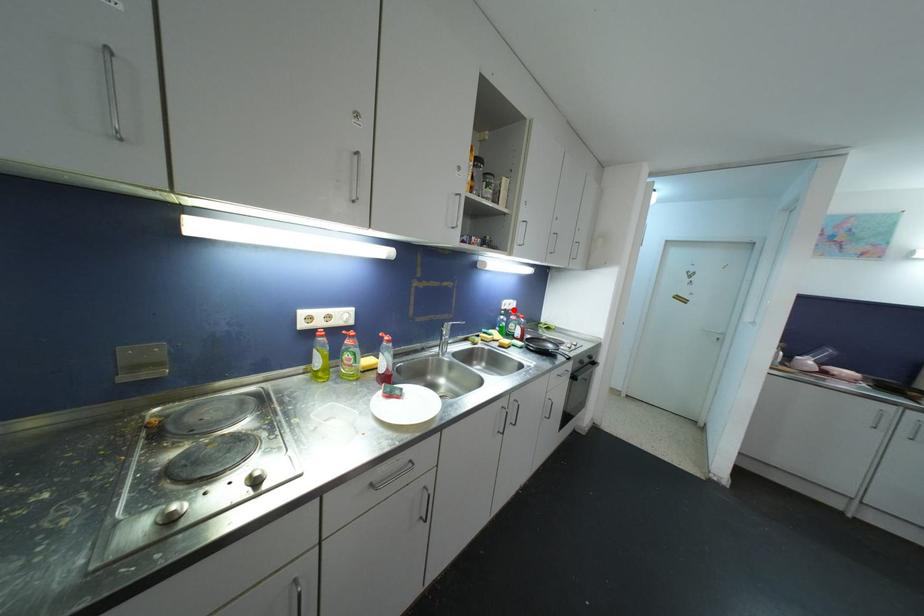
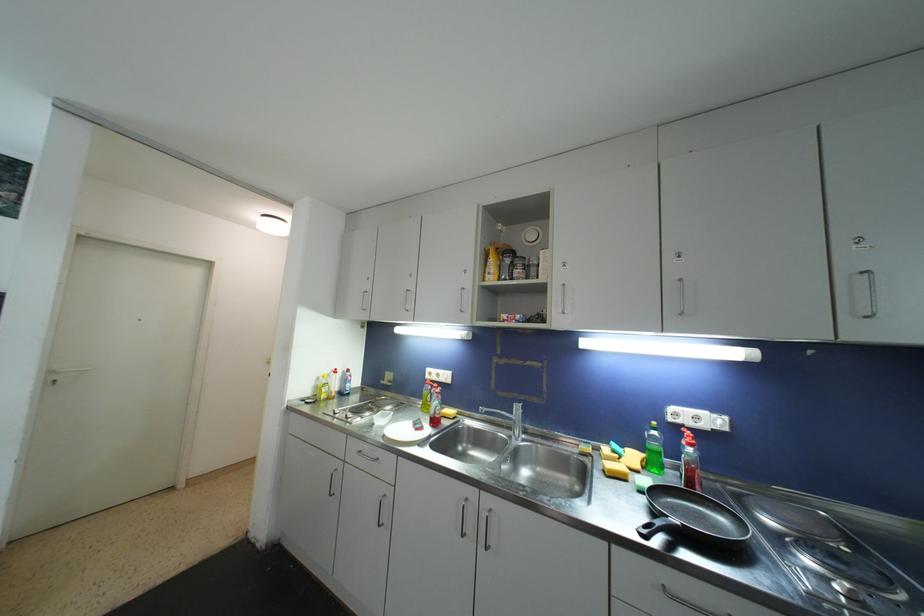
The point at the highlighted location is marked in the first image. Where is the corresponding point in the second image?

(708, 429)